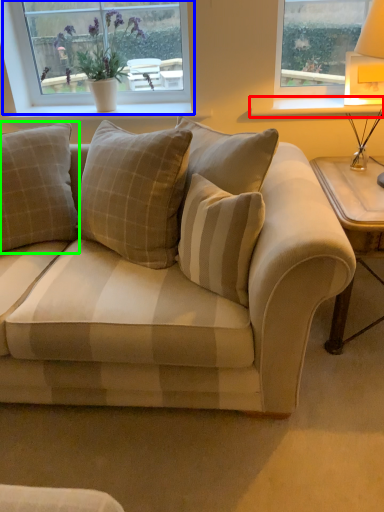
Question: Which is nearer to the window sill (highlighted by a red box)? window (highlighted by a blue box) or pillow (highlighted by a green box).

Choices:
 (A) window
 (B) pillow

Answer: (A)